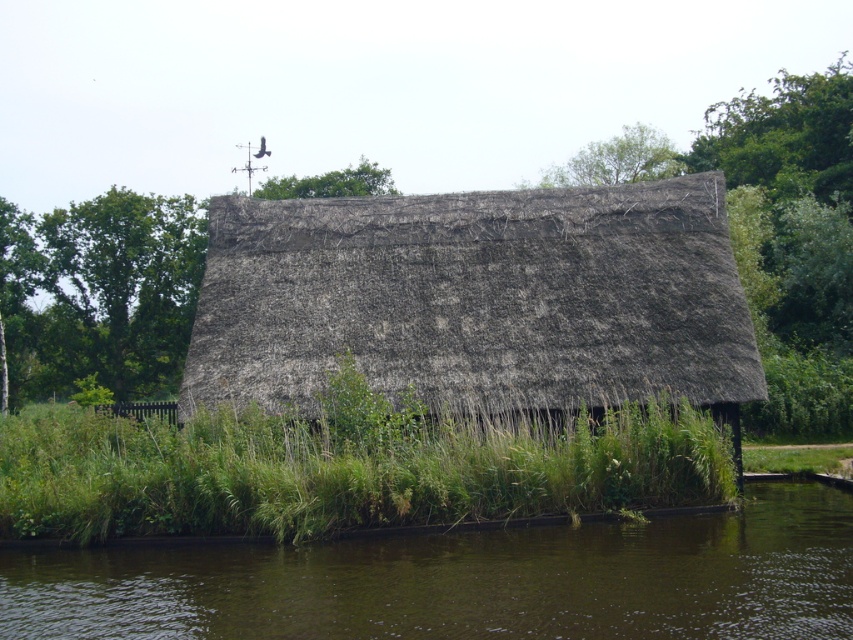
In the scene shown: You are standing at point (461, 582) and want to walk towards the thatched roof structure. Is point (253, 330) located behind you or in front of you relative to your direction of travel?

Point (253, 330) is behind point (461, 582), so if you are facing the thatched roof structure, point (253, 330) would be behind you relative to your direction of travel.

You are standing at the edge of the pond and see the structure with a brown thatch roof at center. There is a point at coordinates [476,300]. Is this point located on the roof of the structure?

Yes, the point at coordinates [476,300] is located on the brown thatch roof at center.